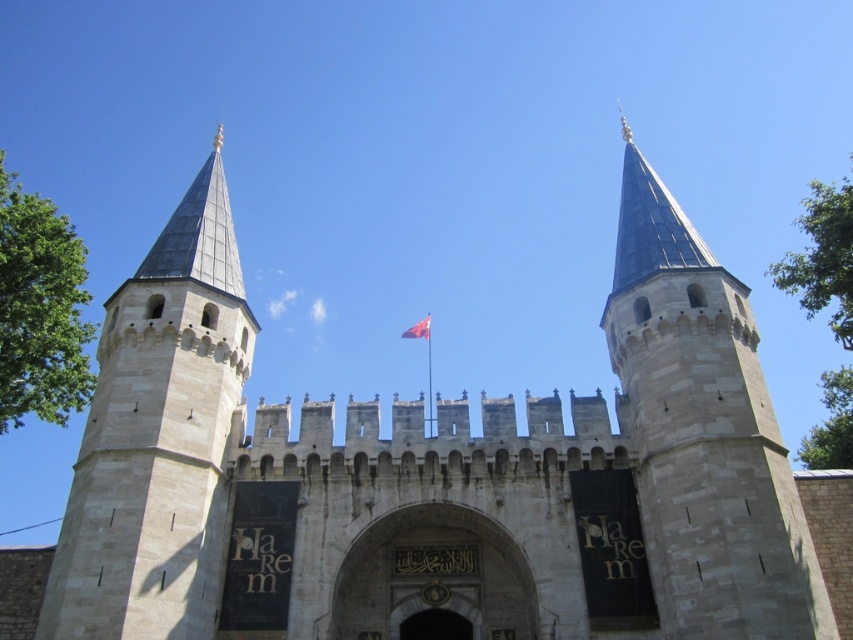
Question: Is stone tower at center further to the viewer compared to dark stone archway at center?

Choices:
 (A) yes
 (B) no

Answer: (B)

Question: Based on their relative distances, which object is farther from the dark stone archway at center?

Choices:
 (A) red fabric flag at center
 (B) light beige stone tower at left
 (C) stone tower at center

Answer: (A)

Question: Which object is the closest to the dark stone archway at center?

Choices:
 (A) light beige stone tower at left
 (B) stone tower at center
 (C) red fabric flag at center

Answer: (A)

Question: Which object is positioned farthest from the light beige stone tower at left?

Choices:
 (A) stone tower at center
 (B) dark stone archway at center
 (C) red fabric flag at center

Answer: (A)

Question: Is stone tower at center thinner than red fabric flag at center?

Choices:
 (A) no
 (B) yes

Answer: (A)

Question: Does stone tower at center appear on the left side of dark stone archway at center?

Choices:
 (A) yes
 (B) no

Answer: (B)